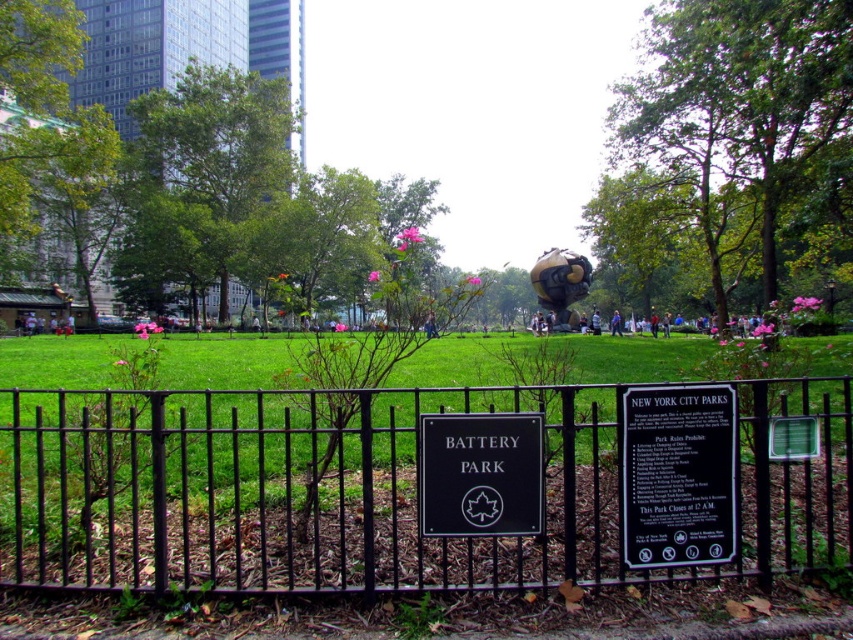
Looking at this image, is green leafy tree at upper left wider than green matte sign at center?

Yes, green leafy tree at upper left is wider than green matte sign at center.

Does green leafy tree at upper left appear on the left side of green matte sign at center?

Indeed, green leafy tree at upper left is positioned on the left side of green matte sign at center.

I want to click on green leafy tree at upper left, so click(x=207, y=172).

Can you confirm if black plastic sign at center is thinner than green matte sign at center?

No.

Locate an element on the screen. Image resolution: width=853 pixels, height=640 pixels. black plastic sign at center is located at coordinates (677, 476).

Between black metal fence at center and green leafy tree at upper left, which one appears on the left side from the viewer's perspective?

Positioned to the left is green leafy tree at upper left.

Measure the distance between black metal fence at center and camera.

The distance of black metal fence at center from camera is 20.82 feet.

Is point (496, 580) positioned before point (209, 259)?

That is True.

At what (x,y) coordinates should I click in order to perform the action: click on black metal fence at center. Please return your answer as a coordinate pair (x, y). The image size is (853, 640). Looking at the image, I should click on tap(370, 490).